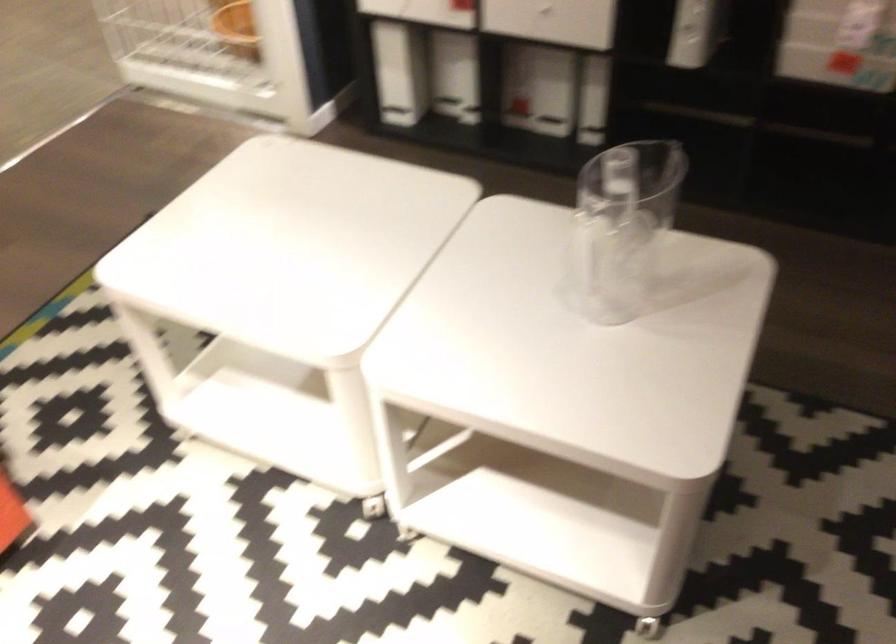
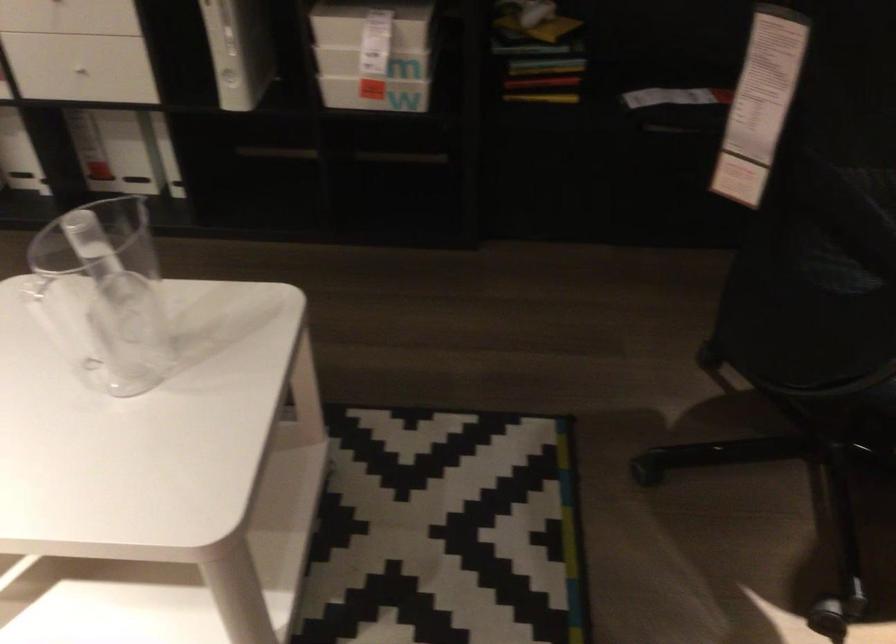
Question: Which direction would the cameraman need to move to produce the second image? Reply with the corresponding letter.

Choices:
 (A) Left
 (B) Right
 (C) Forward
 (D) Backward

Answer: (B)